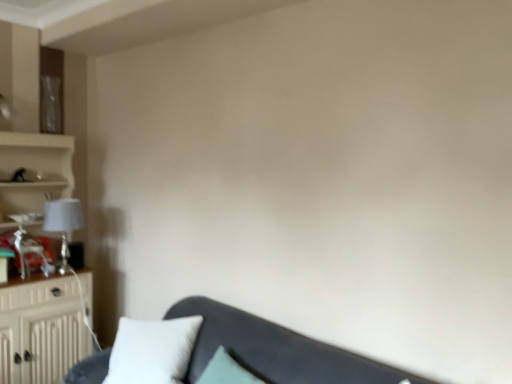
Question: From the image's perspective, would you say matte white lampshade at left is positioned over velvet dark gray couch at lower center?

Choices:
 (A) no
 (B) yes

Answer: (B)

Question: Is matte white lampshade at left wider than velvet dark gray couch at lower center?

Choices:
 (A) no
 (B) yes

Answer: (A)

Question: Considering the relative sizes of matte white lampshade at left and velvet dark gray couch at lower center in the image provided, is matte white lampshade at left smaller than velvet dark gray couch at lower center?

Choices:
 (A) no
 (B) yes

Answer: (B)

Question: Is matte white lampshade at left bigger than velvet dark gray couch at lower center?

Choices:
 (A) no
 (B) yes

Answer: (A)

Question: Is matte white lampshade at left not close to velvet dark gray couch at lower center?

Choices:
 (A) no
 (B) yes

Answer: (B)

Question: From a real-world perspective, relative to matte white lampshade at left, is white soft pillow at lower left vertically above or below?

Choices:
 (A) above
 (B) below

Answer: (B)

Question: Looking at the image, does white soft pillow at lower left seem bigger or smaller compared to matte white lampshade at left?

Choices:
 (A) big
 (B) small

Answer: (A)

Question: Does point (142, 367) appear closer or farther from the camera than point (57, 210)?

Choices:
 (A) closer
 (B) farther

Answer: (A)

Question: Is white soft pillow at lower left inside or outside of matte white lampshade at left?

Choices:
 (A) inside
 (B) outside

Answer: (B)

Question: From a real-world perspective, relative to beige wood cabinet at left, is velvet dark gray couch at lower center vertically above or below?

Choices:
 (A) below
 (B) above

Answer: (A)

Question: Based on their positions, is velvet dark gray couch at lower center located to the left or right of beige wood cabinet at left?

Choices:
 (A) right
 (B) left

Answer: (A)

Question: Is velvet dark gray couch at lower center bigger or smaller than beige wood cabinet at left?

Choices:
 (A) small
 (B) big

Answer: (B)

Question: Is velvet dark gray couch at lower center taller or shorter than beige wood cabinet at left?

Choices:
 (A) tall
 (B) short

Answer: (B)

Question: Considering the relative positions of matte white lampshade at left and velvet dark gray couch at lower center in the image provided, is matte white lampshade at left to the left or to the right of velvet dark gray couch at lower center?

Choices:
 (A) right
 (B) left

Answer: (B)

Question: Is point (68, 221) positioned closer to the camera than point (251, 327)?

Choices:
 (A) farther
 (B) closer

Answer: (A)